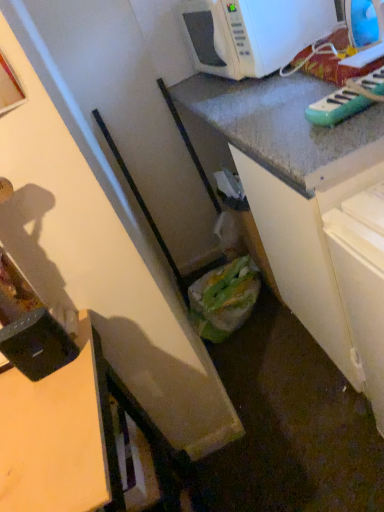
Locate an element on the screen. Image resolution: width=384 pixels, height=512 pixels. free point below green plastic bag at lower center (from a real-world perspective) is located at coordinates (247, 327).